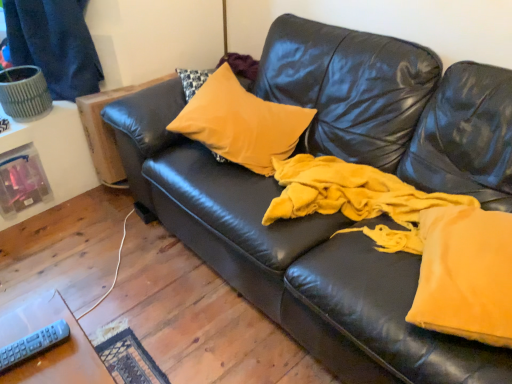
Question: Is velvet yellow blanket at center, which appears as the 2th fabric when viewed from the front, bigger or smaller than satin yellow pillow at center?

Choices:
 (A) big
 (B) small

Answer: (A)

Question: Is velvet yellow blanket at center, which appears as the 2th fabric when viewed from the front, to the left or to the right of satin yellow pillow at center in the image?

Choices:
 (A) left
 (B) right

Answer: (B)

Question: Which object is positioned closest to the gray plastic remote at lower left?

Choices:
 (A) velvet yellow blanket at center, placed as the first fabric when sorted from back to front
 (B) dark blue fabric at upper left
 (C) satin yellow pillow at center
 (D) velvet yellow pillow at right, the first fabric in the front-to-back sequence

Answer: (D)

Question: Which is farther from the velvet yellow blanket at center, which appears as the 2th fabric when viewed from the front?

Choices:
 (A) satin yellow pillow at center
 (B) gray plastic remote at lower left
 (C) dark blue fabric at upper left
 (D) velvet yellow pillow at right, placed as the second fabric when sorted from back to front

Answer: (C)